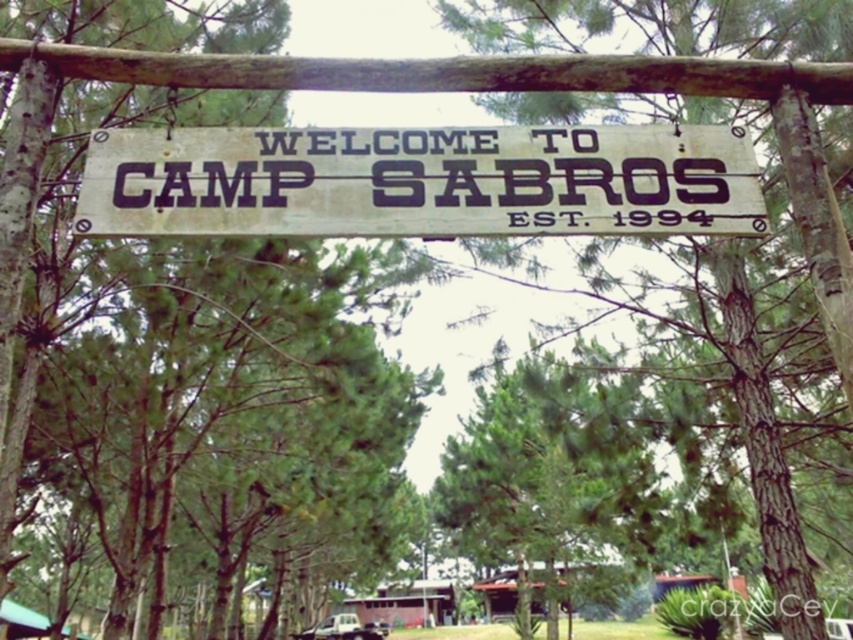
Question: Does green leafy tree at center appear on the right side of brown rough bark tree at center?

Choices:
 (A) no
 (B) yes

Answer: (A)

Question: Which of the following is the closest to the observer?

Choices:
 (A) (323, 218)
 (B) (757, 476)

Answer: (A)

Question: Is green leafy tree at center smaller than rusty wood sign at center?

Choices:
 (A) no
 (B) yes

Answer: (A)

Question: Observing the image, what is the correct spatial positioning of rusty wood sign at center in reference to brown rough bark tree at center?

Choices:
 (A) below
 (B) above

Answer: (A)

Question: Which point appears closest to the camera in this image?

Choices:
 (A) (756, 198)
 (B) (778, 22)

Answer: (A)

Question: Which of the following is the farthest from the observer?

Choices:
 (A) green leafy tree at center
 (B) brown rough bark tree at center

Answer: (B)